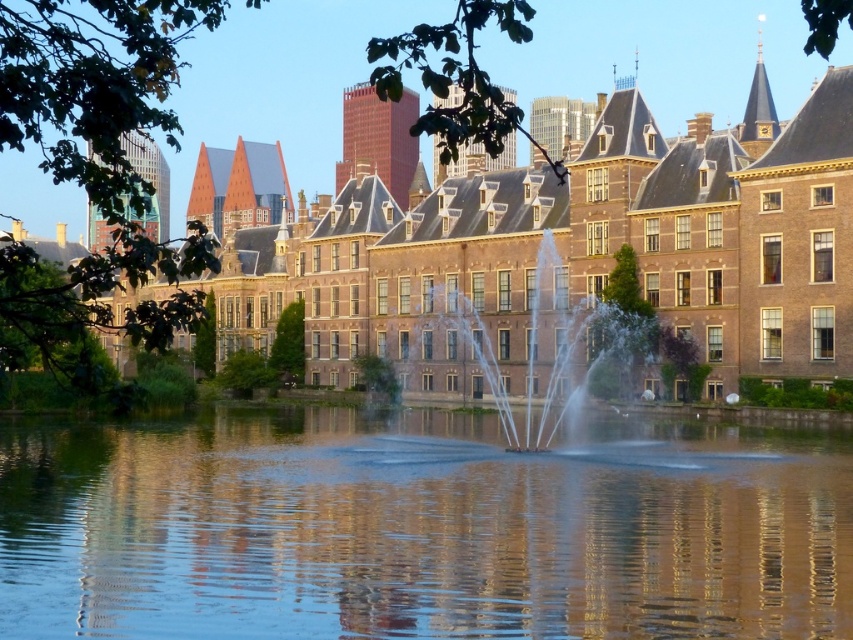
Question: Among these points, which one is nearest to the camera?

Choices:
 (A) (401, 264)
 (B) (527, 413)
 (C) (347, 616)

Answer: (C)

Question: Which point is farther to the camera?

Choices:
 (A) transparent water at center
 (B) brown brick building at center

Answer: (A)

Question: Observing the image, what is the correct spatial positioning of transparent water at center in reference to clear water jets at center?

Choices:
 (A) above
 (B) below

Answer: (B)

Question: Does transparent water at center appear under brown brick building at center?

Choices:
 (A) yes
 (B) no

Answer: (A)

Question: Which object is farther from the camera taking this photo?

Choices:
 (A) clear water jets at center
 (B) brown brick building at center
 (C) transparent water at center

Answer: (A)

Question: Can you confirm if transparent water at center is positioned below clear water jets at center?

Choices:
 (A) yes
 (B) no

Answer: (A)